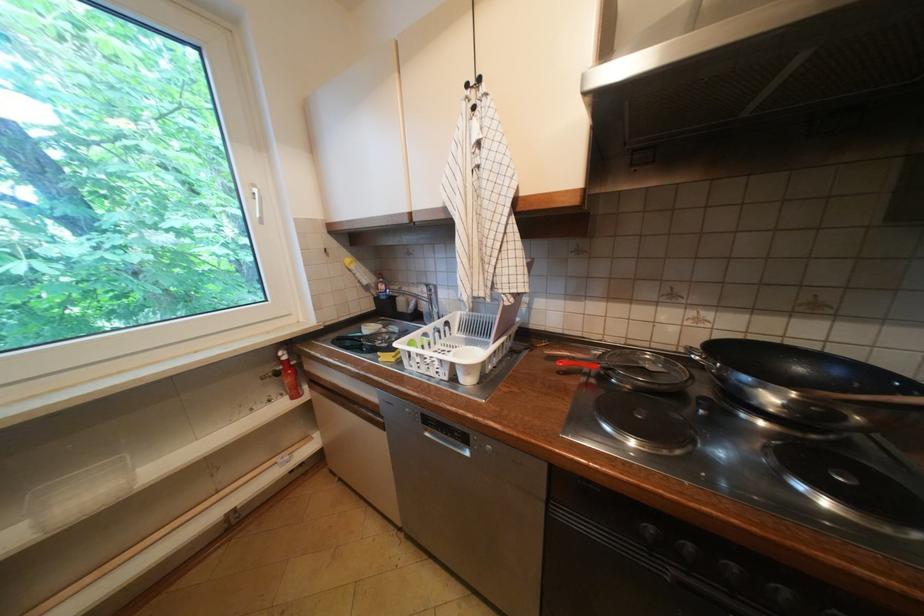
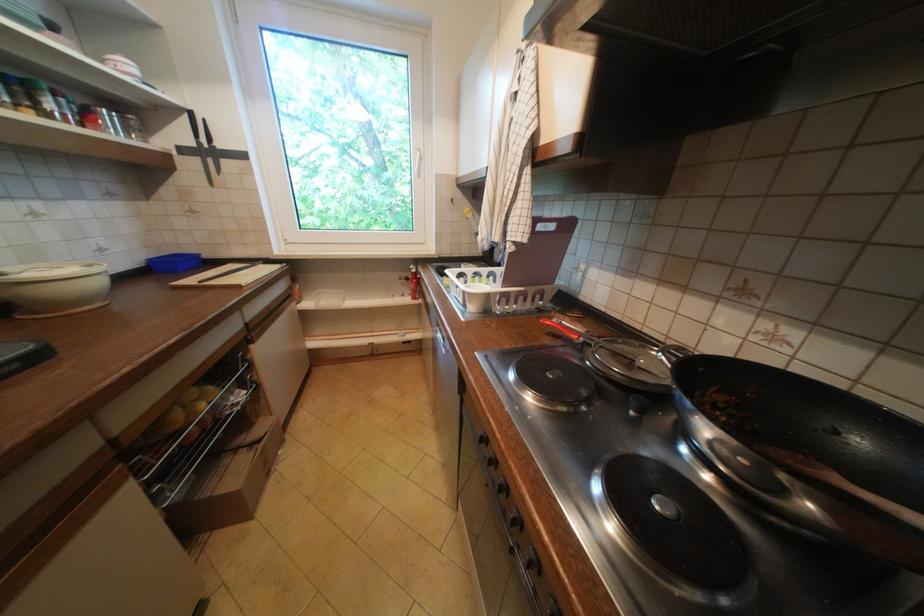
Find the pixel in the second image that matches (x=569, y=374) in the first image.

(558, 334)